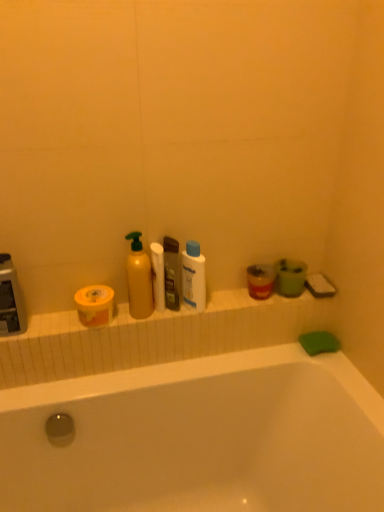
Question: Should I look upward or downward to see translucent plastic soap dispenser at center?

Choices:
 (A) down
 (B) up

Answer: (A)

Question: From a real-world perspective, is yellow matte toilet paper at left, which appears as the 1th toilet paper when viewed from the left, over translucent plastic mouthwash at right?

Choices:
 (A) yes
 (B) no

Answer: (A)

Question: Is translucent plastic mouthwash at right at the back of yellow matte toilet paper at left, which appears as the 1th toilet paper when viewed from the left?

Choices:
 (A) no
 (B) yes

Answer: (A)

Question: Is yellow matte toilet paper at left, which appears as the 1th toilet paper when viewed from the left, oriented towards translucent plastic mouthwash at right?

Choices:
 (A) no
 (B) yes

Answer: (A)

Question: Can you confirm if yellow matte toilet paper at left, which appears as the 1th toilet paper when viewed from the left, is positioned to the right of translucent plastic mouthwash at right?

Choices:
 (A) yes
 (B) no

Answer: (B)

Question: Are yellow matte toilet paper at left, which appears as the 1th toilet paper when viewed from the left, and translucent plastic mouthwash at right located far from each other?

Choices:
 (A) no
 (B) yes

Answer: (A)

Question: Is yellow matte toilet paper at left, marked as the second toilet paper in a right-to-left arrangement, smaller than translucent plastic mouthwash at right?

Choices:
 (A) yes
 (B) no

Answer: (B)

Question: Is the position of yellow matte toilet paper at left, which appears as the 1th toilet paper when viewed from the left, more distant than that of white matte toilet paper at center, which is the first toilet paper in right-to-left order?

Choices:
 (A) no
 (B) yes

Answer: (A)

Question: Is yellow matte toilet paper at left, which appears as the 1th toilet paper when viewed from the left, wider than white matte toilet paper at center, marked as the 2th toilet paper in a left-to-right arrangement?

Choices:
 (A) yes
 (B) no

Answer: (A)

Question: Is yellow matte toilet paper at left, marked as the second toilet paper in a right-to-left arrangement, looking in the opposite direction of white matte toilet paper at center, which is the first toilet paper in right-to-left order?

Choices:
 (A) no
 (B) yes

Answer: (A)

Question: From a real-world perspective, is yellow matte toilet paper at left, which appears as the 1th toilet paper when viewed from the left, under white matte toilet paper at center, marked as the 2th toilet paper in a left-to-right arrangement?

Choices:
 (A) yes
 (B) no

Answer: (A)

Question: Does yellow matte toilet paper at left, marked as the second toilet paper in a right-to-left arrangement, have a lesser height compared to white matte toilet paper at center, which is the first toilet paper in right-to-left order?

Choices:
 (A) yes
 (B) no

Answer: (A)

Question: Can you confirm if yellow matte toilet paper at left, which appears as the 1th toilet paper when viewed from the left, is bigger than white matte toilet paper at center, marked as the 2th toilet paper in a left-to-right arrangement?

Choices:
 (A) no
 (B) yes

Answer: (B)

Question: Considering the relative sizes of translucent plastic mouthwash at right and yellow matte bottle at center, which appears as the second cleaning product when viewed from the right, in the image provided, is translucent plastic mouthwash at right taller than yellow matte bottle at center, which appears as the second cleaning product when viewed from the right,?

Choices:
 (A) no
 (B) yes

Answer: (A)